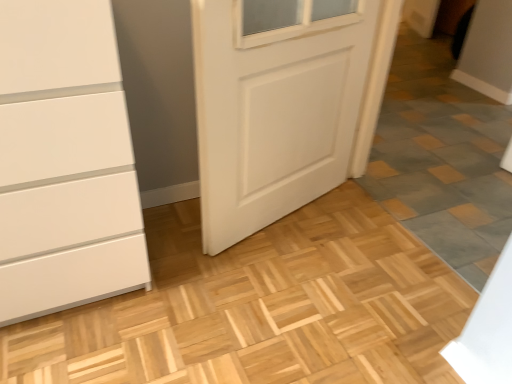
Question: Are white matte door at center and gray stone tile at lower right beside each other?

Choices:
 (A) no
 (B) yes

Answer: (A)

Question: From the image's perspective, is white matte door at center located beneath gray stone tile at lower right?

Choices:
 (A) no
 (B) yes

Answer: (A)

Question: Is the position of white matte door at center more distant than that of gray stone tile at lower right?

Choices:
 (A) no
 (B) yes

Answer: (B)

Question: Does white matte door at center come in front of gray stone tile at lower right?

Choices:
 (A) no
 (B) yes

Answer: (A)

Question: From a real-world perspective, is white matte door at center beneath gray stone tile at lower right?

Choices:
 (A) no
 (B) yes

Answer: (B)

Question: Could you tell me if white matte door at center is turned towards gray stone tile at lower right?

Choices:
 (A) no
 (B) yes

Answer: (B)

Question: From a real-world perspective, is gray stone tile at lower right beneath white matte door at center?

Choices:
 (A) yes
 (B) no

Answer: (B)

Question: Is gray stone tile at lower right positioned with its back to white matte door at center?

Choices:
 (A) no
 (B) yes

Answer: (A)

Question: Is gray stone tile at lower right shorter than white matte door at center?

Choices:
 (A) yes
 (B) no

Answer: (B)

Question: Is gray stone tile at lower right completely or partially outside of white matte door at center?

Choices:
 (A) yes
 (B) no

Answer: (A)

Question: Considering the relative sizes of gray stone tile at lower right and white matte door at center in the image provided, is gray stone tile at lower right smaller than white matte door at center?

Choices:
 (A) no
 (B) yes

Answer: (B)

Question: Does gray stone tile at lower right appear on the left side of white matte door at center?

Choices:
 (A) yes
 (B) no

Answer: (B)

Question: Considering the positions of point (415, 44) and point (384, 41), is point (415, 44) closer or farther from the camera than point (384, 41)?

Choices:
 (A) closer
 (B) farther

Answer: (B)